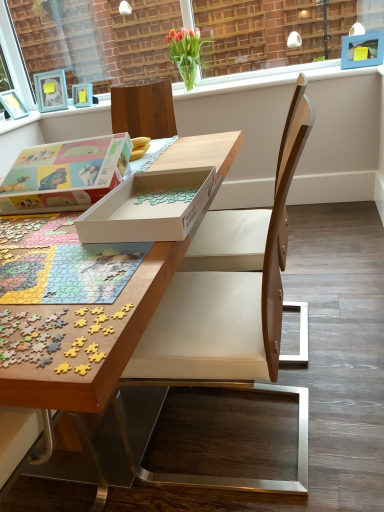
Question: Is matte blue picture frame at upper left, the second picture frame from the right, in contact with white cardboard box at center, which is the second box from right to left?

Choices:
 (A) no
 (B) yes

Answer: (A)

Question: Considering the relative sizes of matte blue picture frame at upper left, the 1th picture frame when ordered from back to front, and white cardboard box at center, which ranks as the 1th box in left-to-right order, in the image provided, is matte blue picture frame at upper left, the 1th picture frame when ordered from back to front, taller than white cardboard box at center, which ranks as the 1th box in left-to-right order,?

Choices:
 (A) yes
 (B) no

Answer: (B)

Question: From the image's perspective, is matte blue picture frame at upper left, the first picture frame positioned from the left, on top of white cardboard box at center, which ranks as the 1th box in left-to-right order?

Choices:
 (A) no
 (B) yes

Answer: (B)

Question: Is white cardboard box at center, which is the second box from right to left, at the back of matte blue picture frame at upper left, the first picture frame positioned from the left?

Choices:
 (A) yes
 (B) no

Answer: (B)

Question: Is matte blue picture frame at upper left, the 1th picture frame when ordered from back to front, positioned far away from white cardboard box at center, which is the second box from right to left?

Choices:
 (A) no
 (B) yes

Answer: (B)

Question: From a real-world perspective, is matte blue picture frame at upper left, the 1th picture frame when ordered from back to front, positioned under white cardboard box at center, which is the second box from right to left, based on gravity?

Choices:
 (A) no
 (B) yes

Answer: (A)

Question: Is the depth of matte blue picture frame at upper left, the 1th picture frame when ordered from back to front, less than that of white plastic window frame at upper center?

Choices:
 (A) yes
 (B) no

Answer: (B)

Question: Is matte blue picture frame at upper left, the second picture frame from the right, further to camera compared to white plastic window frame at upper center?

Choices:
 (A) yes
 (B) no

Answer: (A)

Question: Considering the relative sizes of matte blue picture frame at upper left, the 1th picture frame when ordered from back to front, and white plastic window frame at upper center in the image provided, is matte blue picture frame at upper left, the 1th picture frame when ordered from back to front, shorter than white plastic window frame at upper center?

Choices:
 (A) yes
 (B) no

Answer: (A)

Question: From a real-world perspective, is matte blue picture frame at upper left, the first picture frame positioned from the left, below white plastic window frame at upper center?

Choices:
 (A) yes
 (B) no

Answer: (A)

Question: Is matte blue picture frame at upper left, the first picture frame positioned from the left, to the left of white plastic window frame at upper center from the viewer's perspective?

Choices:
 (A) no
 (B) yes

Answer: (B)

Question: Is matte blue picture frame at upper left, the 2th picture frame positioned from the front, facing away from white plastic window frame at upper center?

Choices:
 (A) yes
 (B) no

Answer: (A)

Question: Can you confirm if blue plastic picture frame at upper right, marked as the first picture frame in a front-to-back arrangement, is wider than wooden chair at center?

Choices:
 (A) no
 (B) yes

Answer: (A)